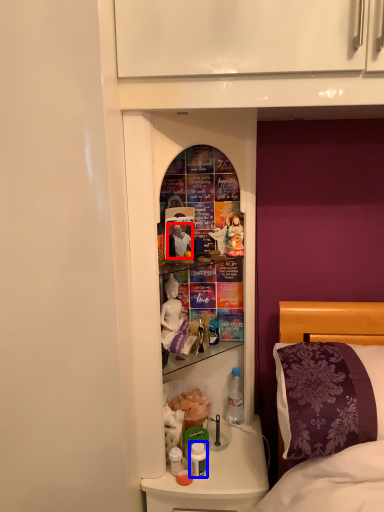
Question: Which point is further to the camera, person (highlighted by a red box) or bottle (highlighted by a blue box)?

Choices:
 (A) person
 (B) bottle

Answer: (A)